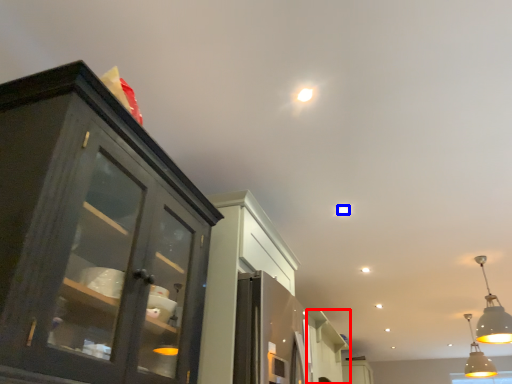
Question: Which object is further to the camera taking this photo, cabinetry (highlighted by a red box) or light (highlighted by a blue box)?

Choices:
 (A) cabinetry
 (B) light

Answer: (A)